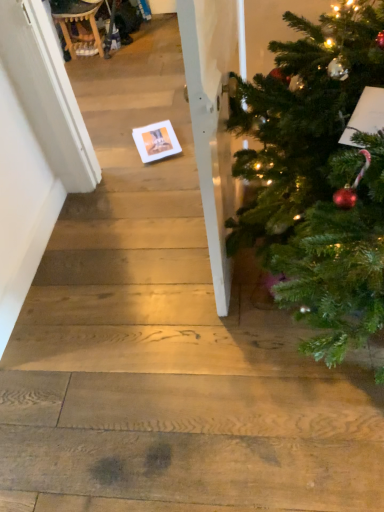
Where is `vacant region to the left of white matte card at center`? vacant region to the left of white matte card at center is located at coordinates (110, 151).